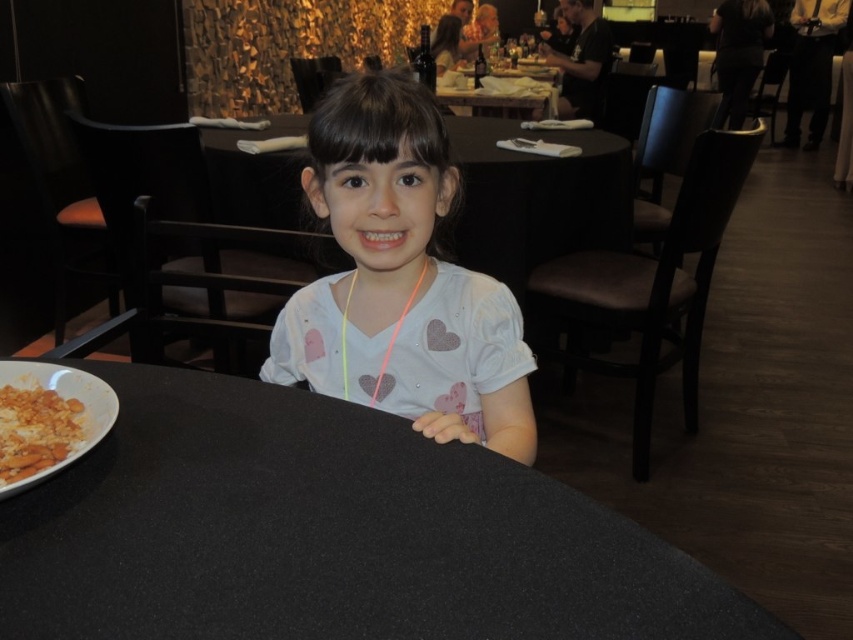
Which is below, white matte shirt at center or yellow crumbly food at lower left?

Positioned lower is yellow crumbly food at lower left.

Is white matte shirt at center smaller than yellow crumbly food at lower left?

Actually, white matte shirt at center might be larger than yellow crumbly food at lower left.

Image resolution: width=853 pixels, height=640 pixels. What do you see at coordinates (399, 280) in the screenshot?
I see `white matte shirt at center` at bounding box center [399, 280].

Identify the location of white matte shirt at center. The image size is (853, 640). pyautogui.click(x=399, y=280).

Is black matte table at center taller than yellow crumbly food at lower left?

Yes, black matte table at center is taller than yellow crumbly food at lower left.

Can you confirm if black matte table at center is positioned to the right of yellow crumbly food at lower left?

Yes, black matte table at center is to the right of yellow crumbly food at lower left.

Locate an element on the screen. black matte table at center is located at coordinates (328, 534).

Between black matte table at center and white matte shirt at center, which one has less height?

Standing shorter between the two is black matte table at center.

Identify the location of black matte table at center. The image size is (853, 640). pyautogui.click(x=328, y=534).

Identify the location of black matte table at center. (328, 534).